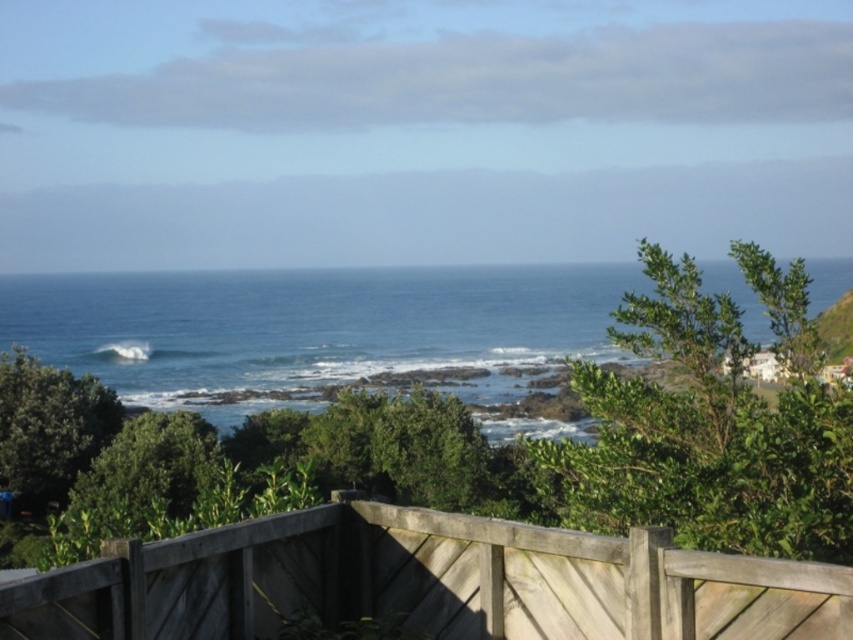
You are standing on the wooden deck and want to place a 2m wide picnic blanket between the wooden fence at lower center and the blue water at center. Can the space between them accommodate the blanket?

The wooden fence at lower center has a lesser width compared to blue water at center, but the description does not provide specific measurements of the distance between them. Therefore, it is unclear if the 2m wide picnic blanket can fit in the space between them.

You are standing on the wooden deck with the railing in front of you. You see the blue water at center and the white frothy wave at lower left. Which one is closer to the railing?

The white frothy wave at lower left is closer to the railing because it is located below the blue water at center.